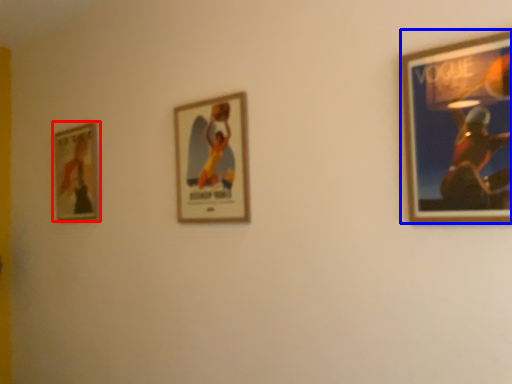
Question: Which point is further to the camera, picture frame (highlighted by a red box) or picture frame (highlighted by a blue box)?

Choices:
 (A) picture frame
 (B) picture frame

Answer: (A)